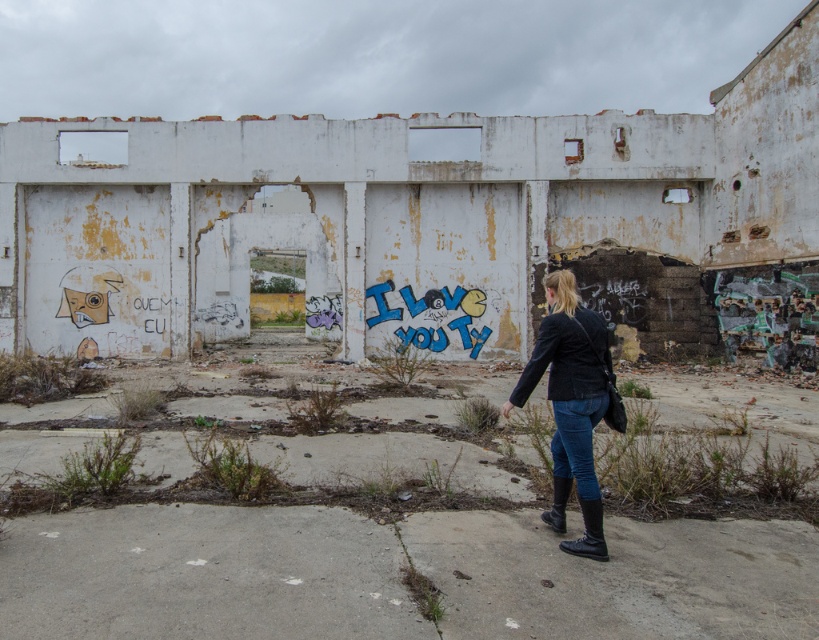
Is black leather boot at lower right positioned at the back of black rubber boot at lower right?

No, black leather boot at lower right is closer to the viewer.

At what (x,y) coordinates should I click in order to perform the action: click on black leather boot at lower right. Please return your answer as a coordinate pair (x, y). This screenshot has width=819, height=640. Looking at the image, I should click on (587, 532).

Identify the location of black leather boot at lower right. click(587, 532).

Does black leather jacket at lower right have a greater height compared to black rubber boot at lower right?

Correct, black leather jacket at lower right is much taller as black rubber boot at lower right.

Between point (571, 362) and point (541, 518), which one is positioned in front?

Point (571, 362)

Locate an element on the screen. The image size is (819, 640). black leather jacket at lower right is located at coordinates (569, 404).

Is black leather jacket at lower right behind black leather boot at lower right?

Yes, black leather jacket at lower right is behind black leather boot at lower right.

Looking at this image, is black leather jacket at lower right smaller than black leather boot at lower right?

No.

Does point (573, 340) come farther from viewer compared to point (563, 544)?

That is False.

Locate an element on the screen. The image size is (819, 640). black leather jacket at lower right is located at coordinates (569, 404).